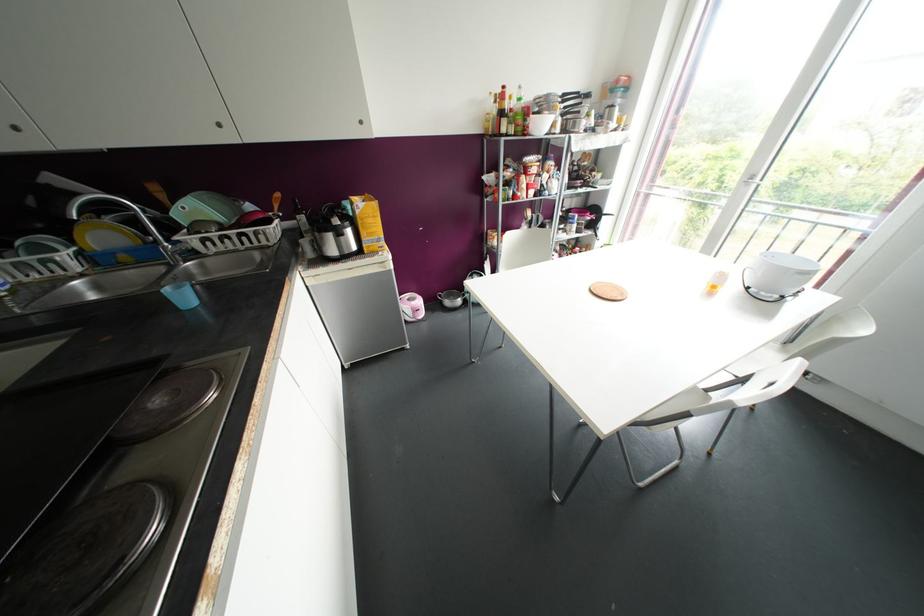
Where is `faucet handle`? The height and width of the screenshot is (616, 924). faucet handle is located at coordinates (183, 251).